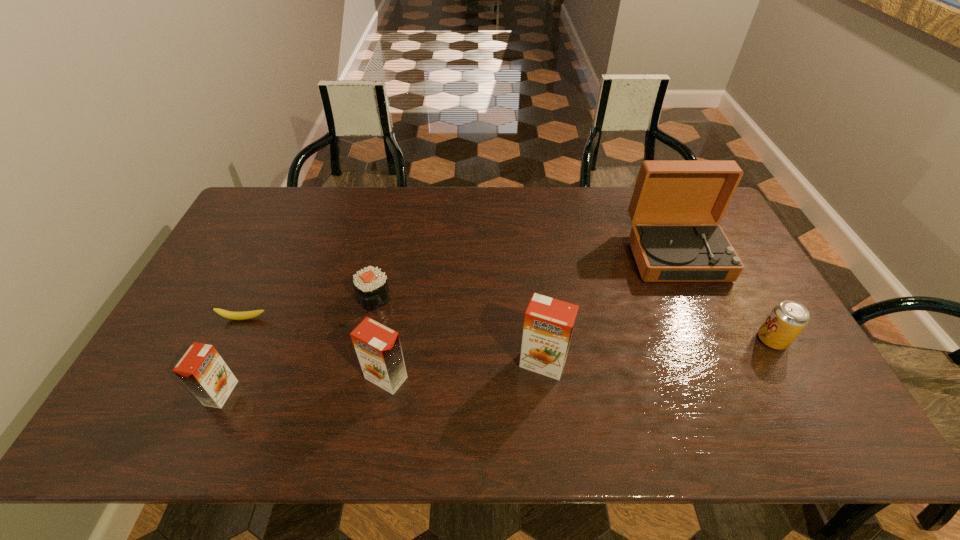
The image size is (960, 540). In order to click on vacant space that is in between the farthest object and the rightmost orange juice in this screenshot , I will do `click(610, 309)`.

Where is `empty space that is in between the banana and the pop (soda)`? empty space that is in between the banana and the pop (soda) is located at coordinates (508, 329).

Identify the location of free space between the phonograph record and the sushi. This screenshot has height=540, width=960. (525, 276).

Find the location of a particular element. free space between the shortest orange juice and the banana is located at coordinates (x=232, y=356).

Locate an element on the screen. vacant area between the fifth nearest object and the second shortest object is located at coordinates (309, 308).

The width and height of the screenshot is (960, 540). I want to click on vacant area that lies between the fifth shortest object and the shortest object, so click(x=315, y=348).

Locate an element on the screen. This screenshot has width=960, height=540. the fifth closest object to the shortest orange juice is located at coordinates (666, 192).

Select which object is the sixth closest to the pop (soda). Please provide its 2D coordinates. Your answer should be formatted as a tuple, i.e. [(x, y)], where the tuple contains the x and y coordinates of a point satisfying the conditions above.

[(202, 370)]

Where is `the second closest orange juice to the sushi`? This screenshot has height=540, width=960. the second closest orange juice to the sushi is located at coordinates (202, 370).

Point out which orange juice is positioned as the nearest to the fifth shortest object. Please provide its 2D coordinates. Your answer should be formatted as a tuple, i.e. [(x, y)], where the tuple contains the x and y coordinates of a point satisfying the conditions above.

[(548, 325)]